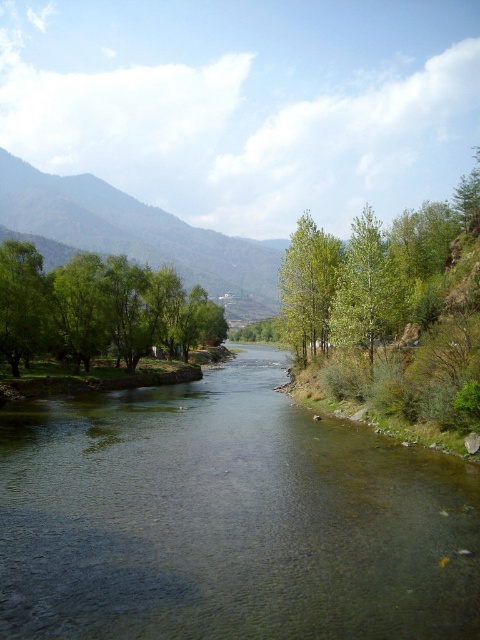
You are an observer standing at the riverbank. You notice the green leafy mountain at upper left and the green leafy tree at center. Which one appears wider from your perspective?

The green leafy mountain at upper left appears wider than the green leafy tree at center because its width surpasses the tree.

You are a bird flying over the river scene. You want to land on the widest tree available. Which one should you choose between the green leafy trees at left and the green leafy tree at left?

The green leafy trees at left might be wider than green leafy tree at left, so you should choose the green leafy trees at left.